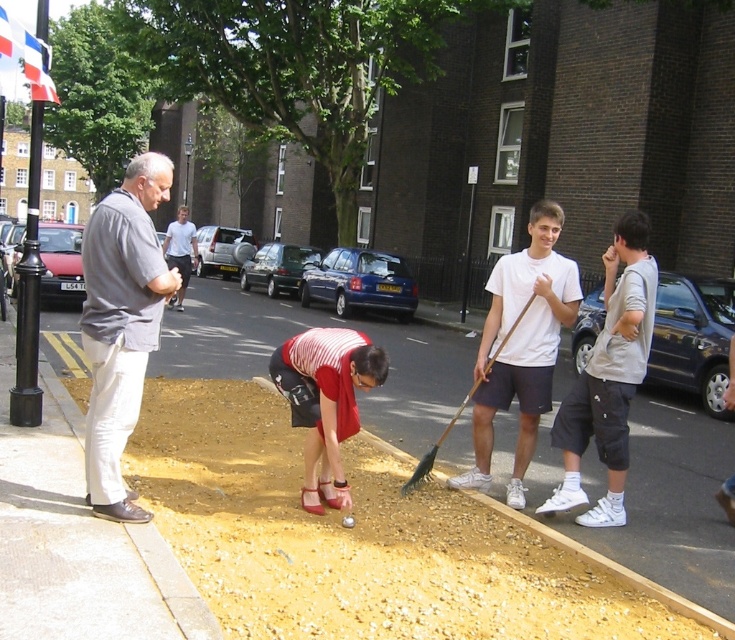
Does striped fabric shirt at center have a greater height compared to wooden shovel at center?

Yes.

Does striped fabric shirt at center have a lesser width compared to wooden shovel at center?

No.

Locate an element on the screen. This screenshot has width=735, height=640. striped fabric shirt at center is located at coordinates (326, 401).

Does light gray cotton shorts at right appear on the right side of striped fabric shirt at center?

Correct, you'll find light gray cotton shorts at right to the right of striped fabric shirt at center.

Is light gray cotton shorts at right positioned before striped fabric shirt at center?

No, it is behind striped fabric shirt at center.

Is point (562, 477) farther from camera compared to point (329, 406)?

Yes, point (562, 477) is behind point (329, 406).

The width and height of the screenshot is (735, 640). Identify the location of light gray cotton shorts at right. (609, 378).

Does white matte t-shirt at center have a greater width compared to light blue shirt at center?

→ In fact, white matte t-shirt at center might be narrower than light blue shirt at center.

Which is behind, point (553, 212) or point (193, 241)?

The point (193, 241) is behind.

At what (x,y) coordinates should I click in order to perform the action: click on white matte t-shirt at center. Please return your answer as a coordinate pair (x, y). Looking at the image, I should click on (520, 346).